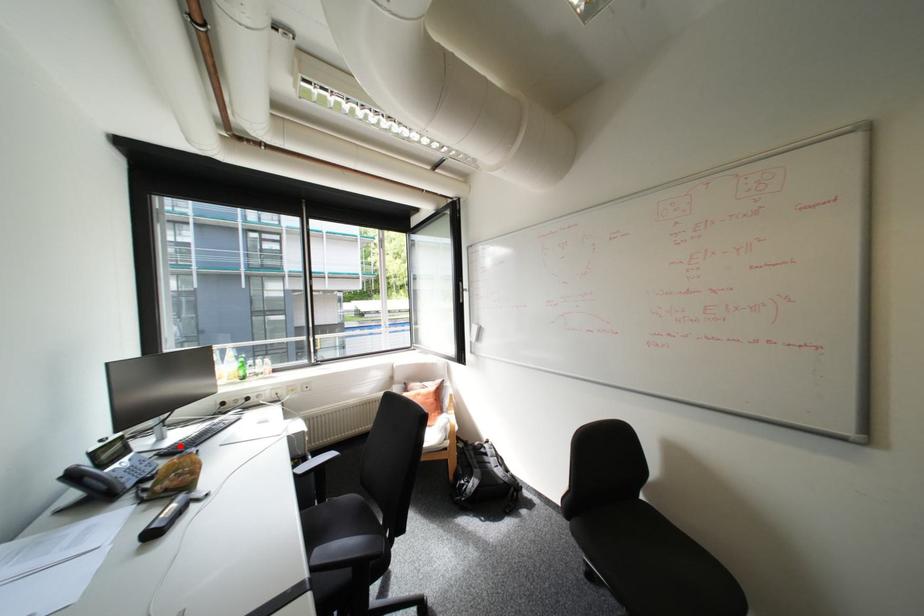
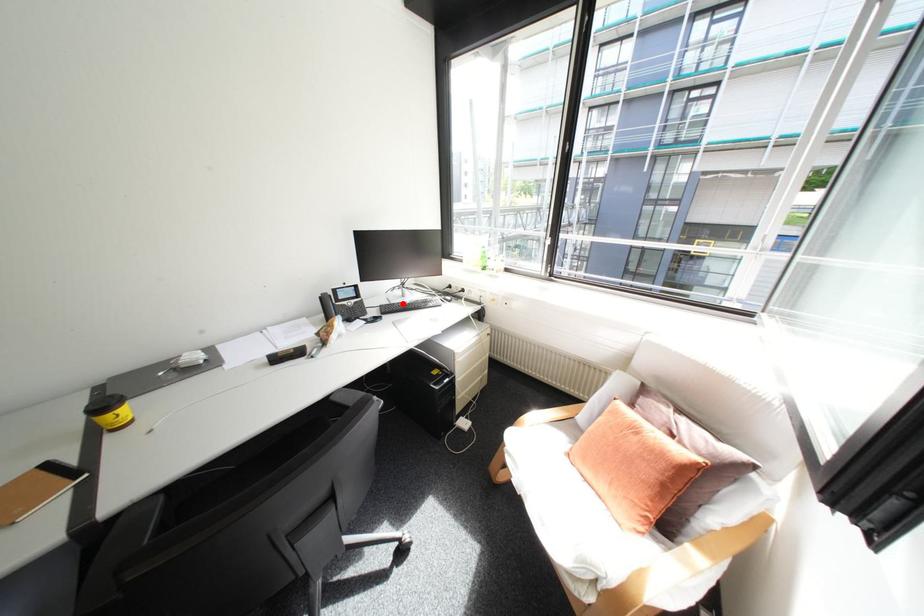
I am providing you with two images of the same scene from different viewpoints. A red point is marked on the first image and another point is marked on the second image. Are the points marked in image1 and image2 representing the same 3D position?

Yes